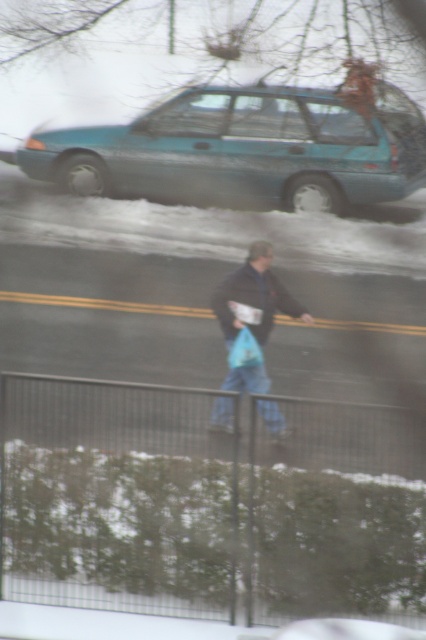
Question: Among these points, which one is nearest to the camera?

Choices:
 (A) (190, 516)
 (B) (253, 288)

Answer: (A)

Question: Which point appears farthest from the camera in this image?

Choices:
 (A) (414, 504)
 (B) (267, 180)

Answer: (B)

Question: Does teal matte station wagon at upper center have a smaller size compared to blue denim jeans at center?

Choices:
 (A) no
 (B) yes

Answer: (A)

Question: Which point appears farthest from the camera in this image?

Choices:
 (A) tap(124, 388)
 (B) tap(414, 182)
 (C) tap(264, 269)

Answer: (B)

Question: Does teal matte station wagon at upper center appear on the left side of blue denim jeans at center?

Choices:
 (A) yes
 (B) no

Answer: (A)

Question: Is metallic wire fence at lower center in front of teal matte station wagon at upper center?

Choices:
 (A) no
 (B) yes

Answer: (B)